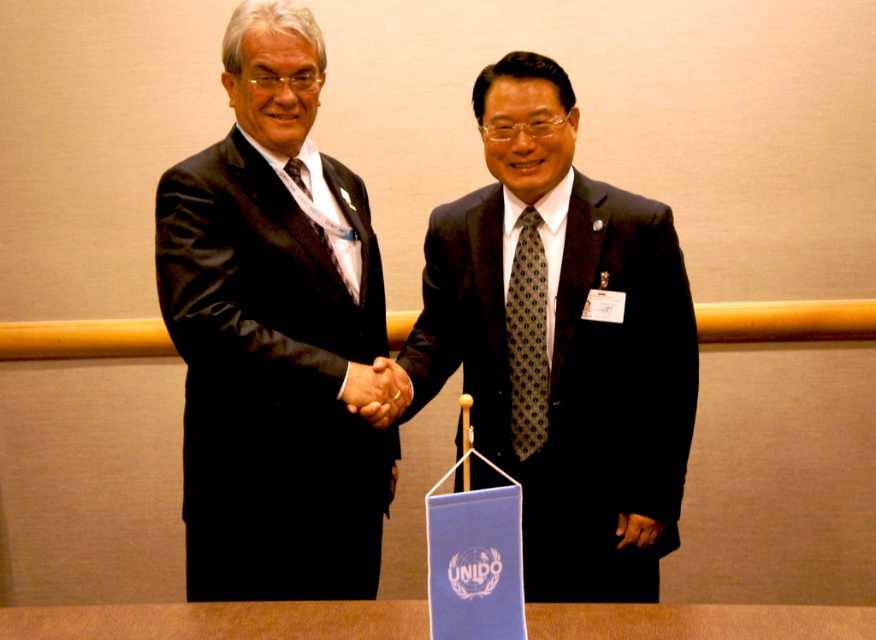
Question: Which of these objects is positioned closest to the green dotted tie at center?

Choices:
 (A) brown wooden table at center
 (B) matte black suit at center

Answer: (B)

Question: Does brown wooden table at center appear on the left side of matte black tie at center?

Choices:
 (A) yes
 (B) no

Answer: (B)

Question: Which object is positioned farthest from the black leather hand at center?

Choices:
 (A) green dotted tie at center
 (B) matte black tie at center
 (C) matte black suit at center
 (D) black satin suit at left

Answer: (C)

Question: Based on their relative distances, which object is nearer to the green dotted tie at center?

Choices:
 (A) black leather hand at center
 (B) brown wooden table at center
 (C) black satin suit at left
 (D) matte black suit at center

Answer: (D)

Question: Where is matte black suit at center located in relation to brown wooden table at center in the image?

Choices:
 (A) left
 (B) right

Answer: (B)

Question: Can you confirm if brown wooden table at center is positioned to the left of matte black tie at center?

Choices:
 (A) no
 (B) yes

Answer: (A)